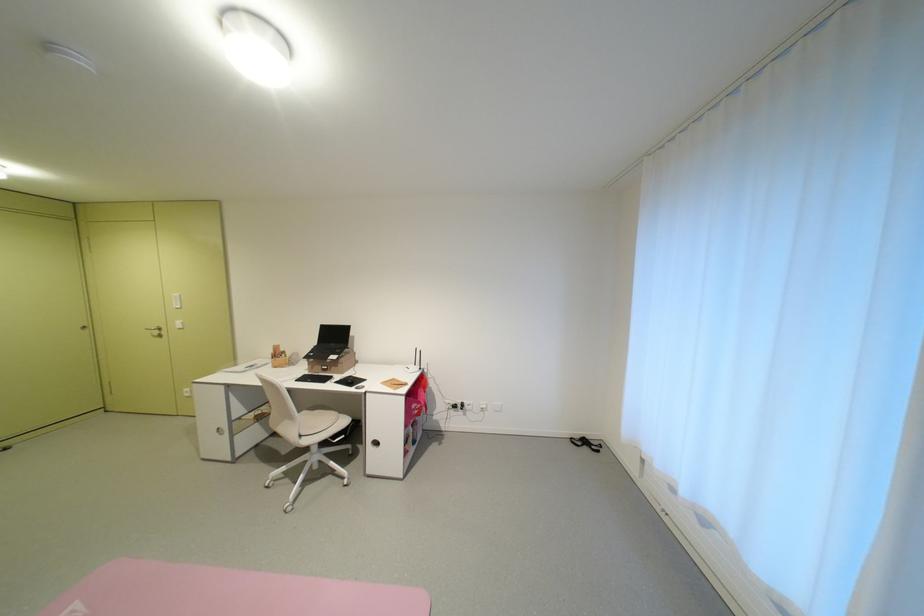
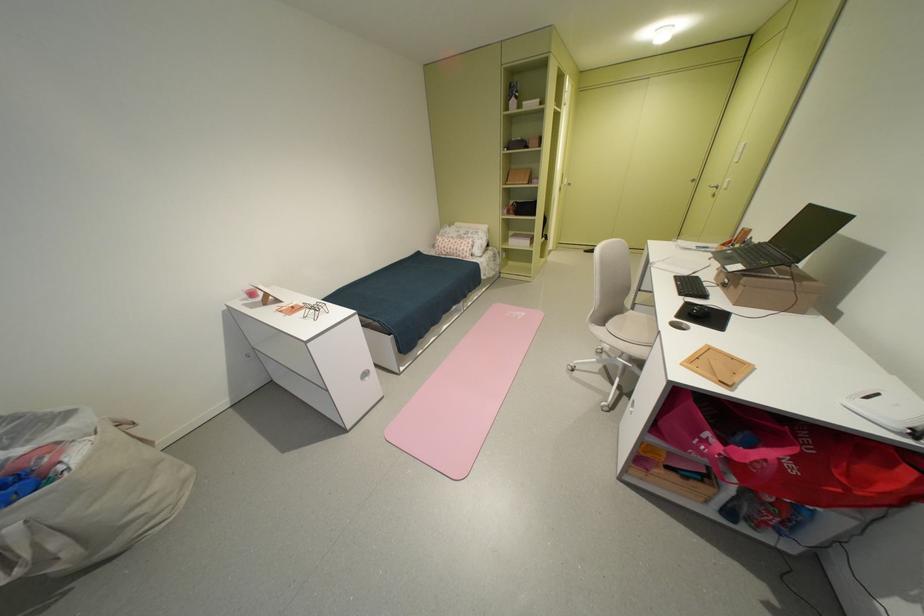
In the second image, find the point that corresponds to (x=346, y=368) in the first image.

(746, 288)